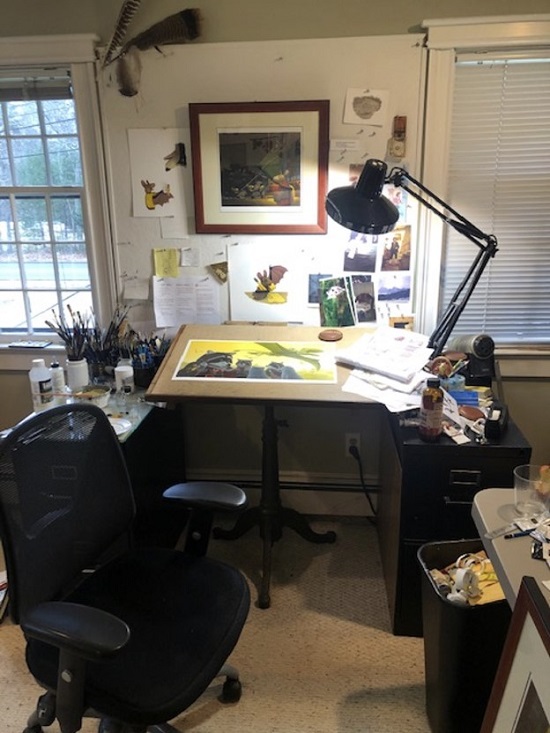
Locate an element on the screen. The image size is (550, 733). yellow paper in trash can is located at coordinates (486, 594).